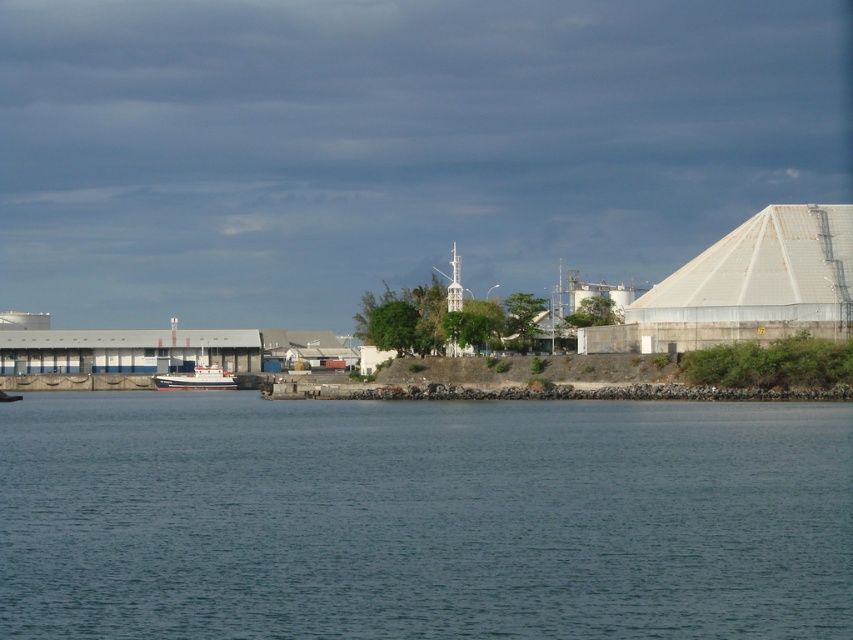
Between point (190, 464) and point (199, 387), which one is positioned in front?

Point (190, 464) is in front.

Is blue water at lower center smaller than white matte boat at center?

No, blue water at lower center is not smaller than white matte boat at center.

The width and height of the screenshot is (853, 640). I want to click on blue water at lower center, so click(422, 516).